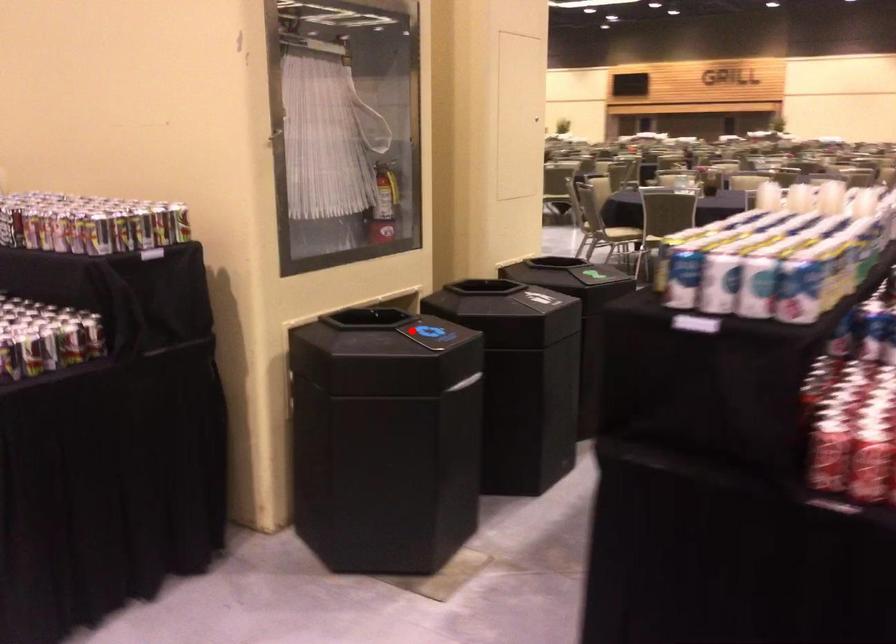
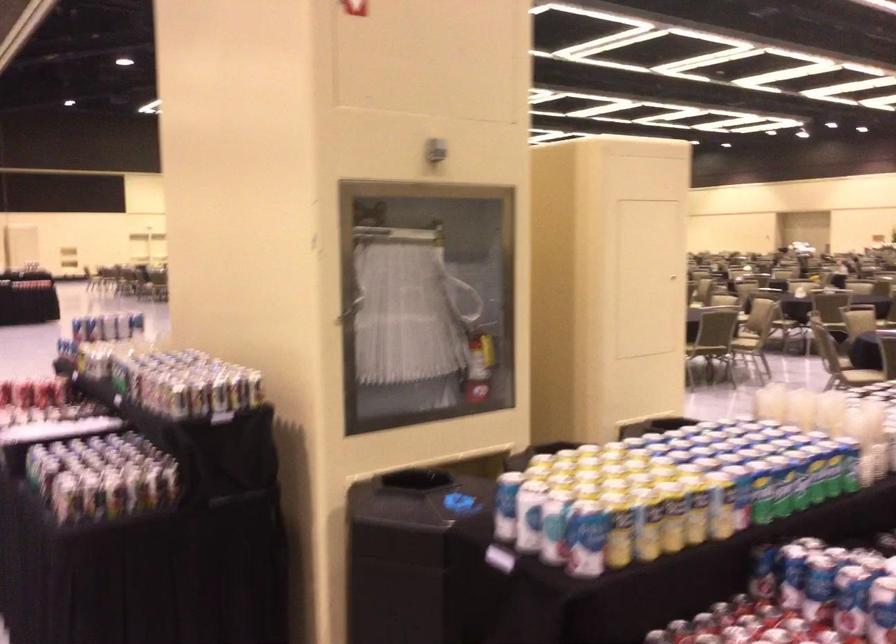
The point at the highlighted location is marked in the first image. Where is the corresponding point in the second image?

(442, 502)